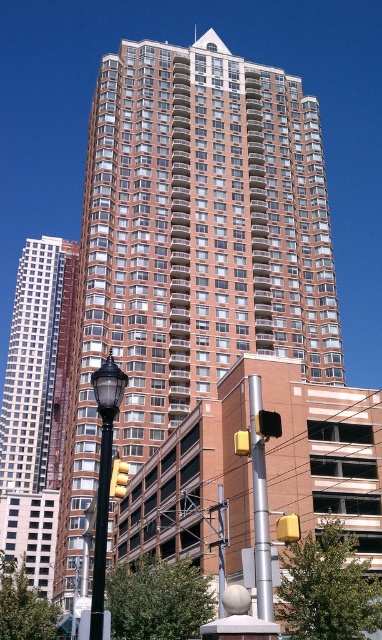
Who is positioned more to the right, yellow matte traffic light at center or yellow plastic traffic light at center?

From the viewer's perspective, yellow matte traffic light at center appears more on the right side.

Which is behind, point (299, 534) or point (234, 440)?

The point (234, 440) is more distant.

Does point (283, 518) come behind point (241, 452)?

No, (283, 518) is closer to viewer.

Where is `yellow matte traffic light at center`? yellow matte traffic light at center is located at coordinates (288, 529).

Between point (103, 493) and point (249, 438), which one is positioned behind?

Point (249, 438)

What do you see at coordinates (103, 477) in the screenshot? I see `black polished streetlight at lower left` at bounding box center [103, 477].

This screenshot has height=640, width=382. Find the location of `black polished streetlight at lower left`. black polished streetlight at lower left is located at coordinates (103, 477).

Is shiny glass skyscraper at left bigger than yellowtransparent glasstraffic light at center?

Correct, shiny glass skyscraper at left is larger in size than yellowtransparent glasstraffic light at center.

Between shiny glass skyscraper at left and yellowtransparent glasstraffic light at center, which one is positioned higher?

yellowtransparent glasstraffic light at center is higher up.

Is point (53, 458) positioned after point (124, 476)?

Yes, it is behind point (124, 476).

Where is `shiny glass skyscraper at left`? This screenshot has width=382, height=640. shiny glass skyscraper at left is located at coordinates (37, 403).